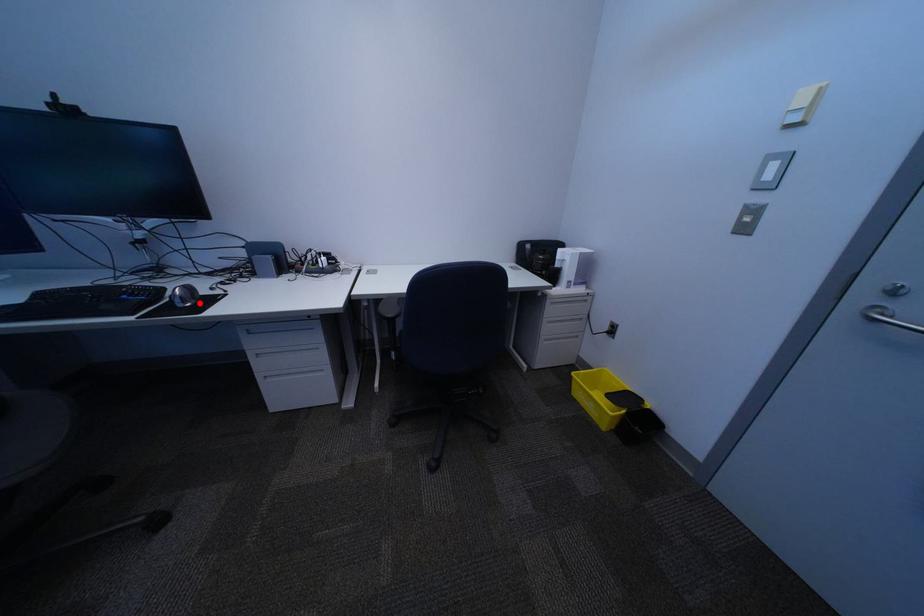
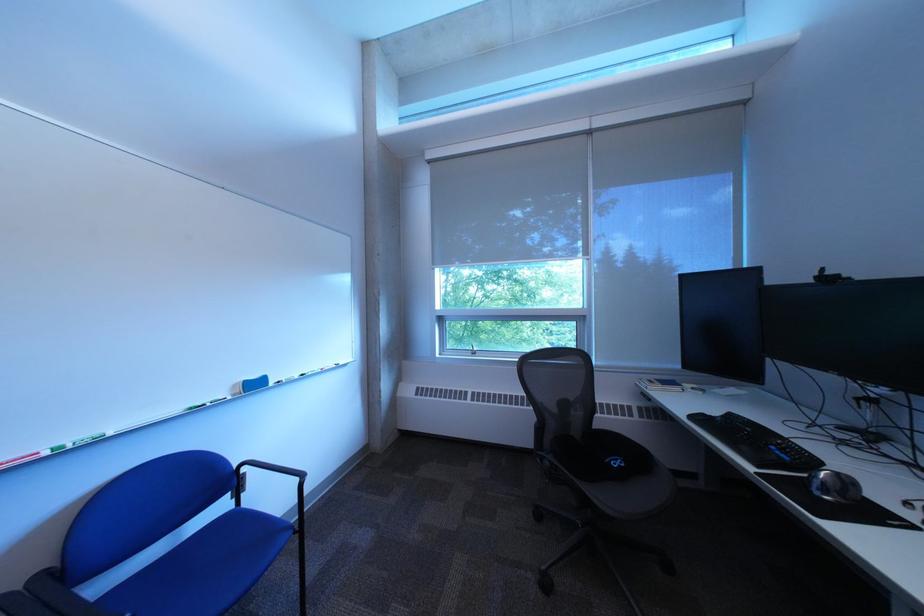
The point at the highlighted location is marked in the first image. Where is the corresponding point in the second image?

(841, 493)